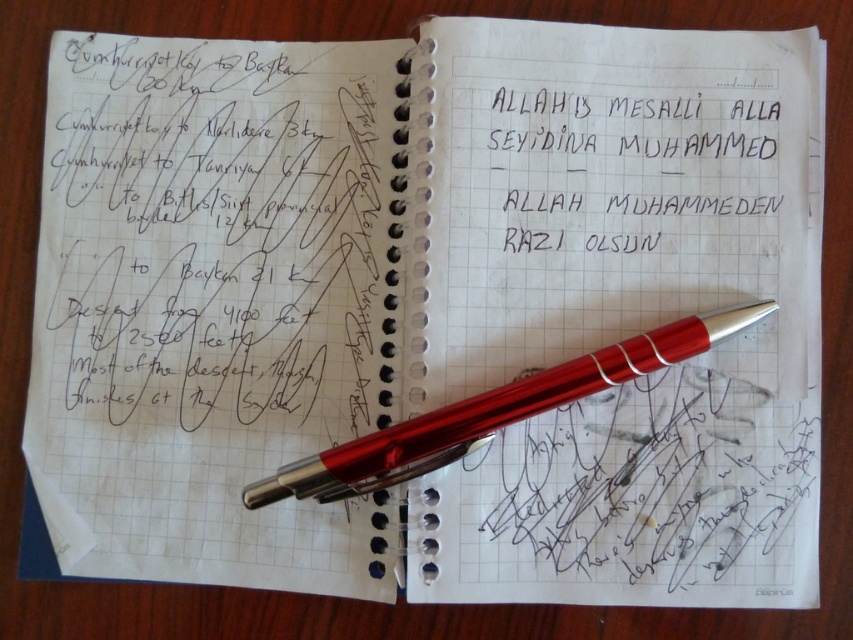
Question: Can you confirm if black handwritten text at upper right is positioned above metallic red pen at center?

Choices:
 (A) no
 (B) yes

Answer: (B)

Question: Which point appears farthest from the camera in this image?

Choices:
 (A) (654, 211)
 (B) (751, 310)

Answer: (A)

Question: Observing the image, what is the correct spatial positioning of black handwritten text at upper right in reference to metallic red pen at center?

Choices:
 (A) right
 (B) left

Answer: (A)

Question: Which of the following is the farthest from the observer?

Choices:
 (A) (410, 422)
 (B) (654, 122)

Answer: (B)

Question: Which point is farther to the camera?

Choices:
 (A) metallic red pen at center
 (B) black handwritten text at upper right

Answer: (B)

Question: Can you confirm if black handwritten text at upper right is thinner than metallic red pen at center?

Choices:
 (A) yes
 (B) no

Answer: (A)